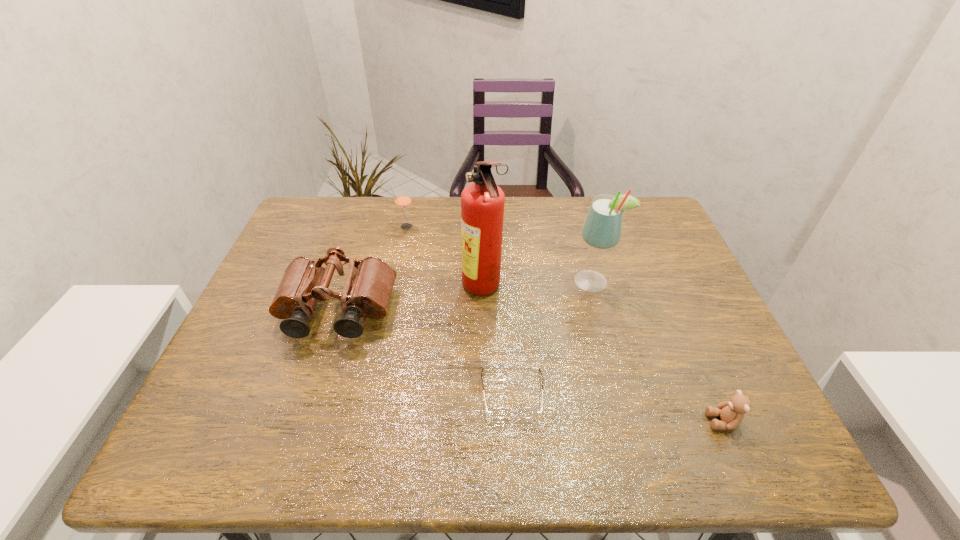
This screenshot has height=540, width=960. I want to click on vacant space located on the front-facing side of the tallest object, so click(x=378, y=289).

You are a GUI agent. You are given a task and a screenshot of the screen. Output one action in this format:
    pyautogui.click(x=<x>, y=<y>)
    Task: Click on the vacant region located on the back of the second object from right to left
    Image resolution: width=960 pixels, height=540 pixels.
    Given the screenshot: What is the action you would take?
    pyautogui.click(x=584, y=248)

You are a GUI agent. You are given a task and a screenshot of the screen. Output one action in this format:
    pyautogui.click(x=<x>, y=<y>)
    Task: Click on the vacant space located on the front of the farthest object
    
    Given the screenshot: What is the action you would take?
    pyautogui.click(x=394, y=286)

You are a GUI agent. You are given a task and a screenshot of the screen. Output one action in this format:
    pyautogui.click(x=<x>, y=<y>)
    Task: Click on the vacant region located 0.210m through the eyepieces of the binoculars
    The height and width of the screenshot is (540, 960).
    Given the screenshot: What is the action you would take?
    tap(300, 428)

You are a GUI agent. You are given a task and a screenshot of the screen. Output one action in this format:
    pyautogui.click(x=<x>, y=<y>)
    Task: Click on the vacant space located on the face of the teddy bear
    
    Given the screenshot: What is the action you would take?
    pyautogui.click(x=609, y=421)

Where is `vacant region located 0.300m on the face of the teddy bear`? vacant region located 0.300m on the face of the teddy bear is located at coordinates (559, 421).

The image size is (960, 540). Identify the location of vacant region located on the face of the teddy bear. (539, 421).

The width and height of the screenshot is (960, 540). What are the coordinates of `object at the far edge` in the screenshot? It's located at (403, 201).

Where is `object at the near edge`? Image resolution: width=960 pixels, height=540 pixels. object at the near edge is located at coordinates (731, 412).

Locate an element on the screen. The height and width of the screenshot is (540, 960). object positioned at the left edge is located at coordinates (367, 292).